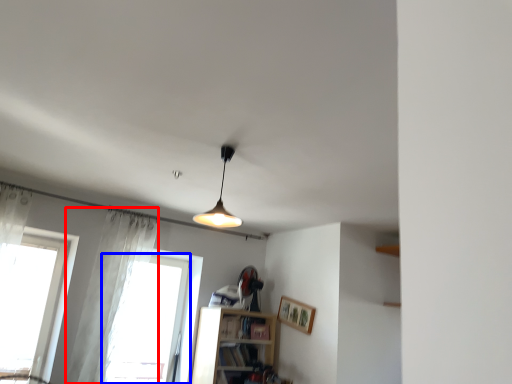
Question: Which object appears closest to the camera in this image, curtain (highlighted by a red box) or window (highlighted by a blue box)?

Choices:
 (A) curtain
 (B) window

Answer: (A)